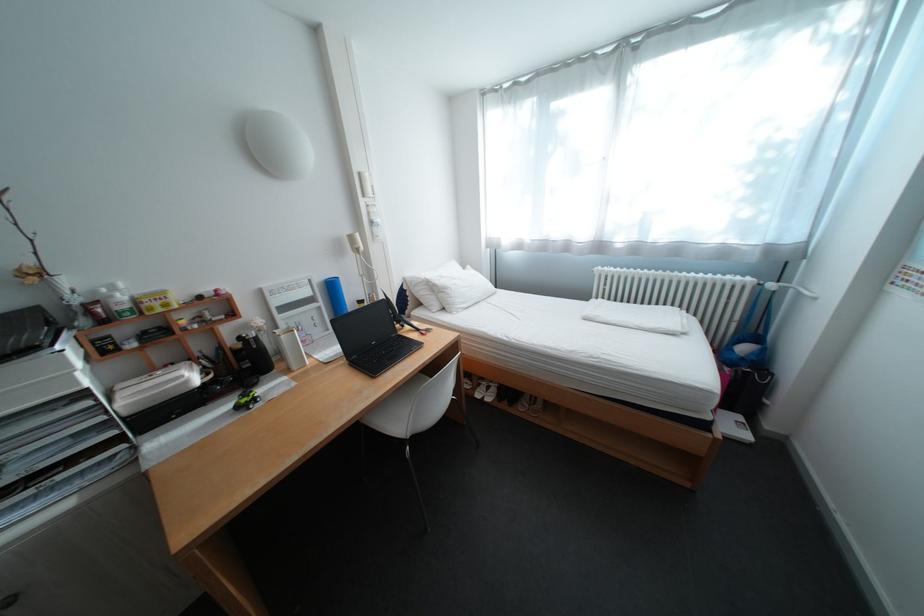
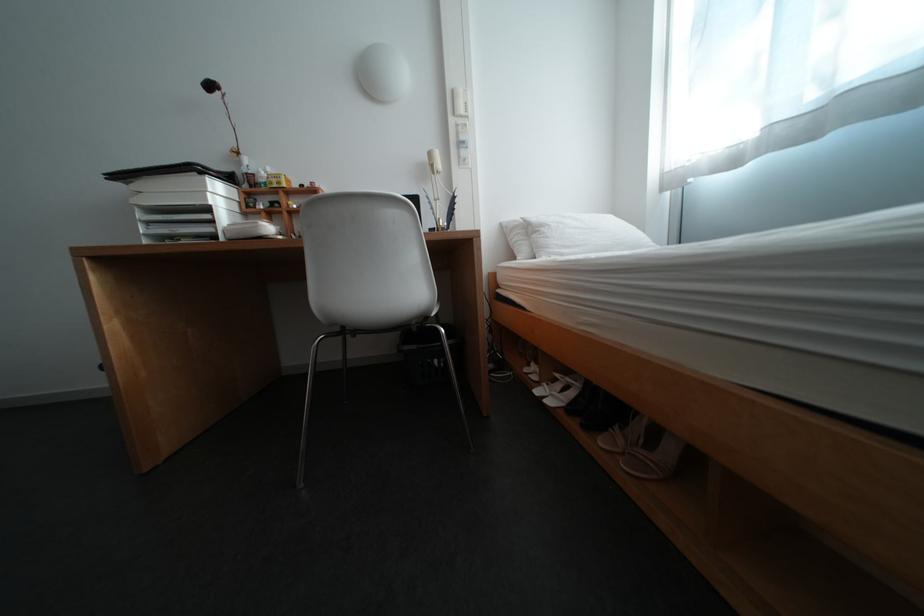
Locate, in the second image, the point that corresponds to point (541, 411) in the first image.

(637, 455)